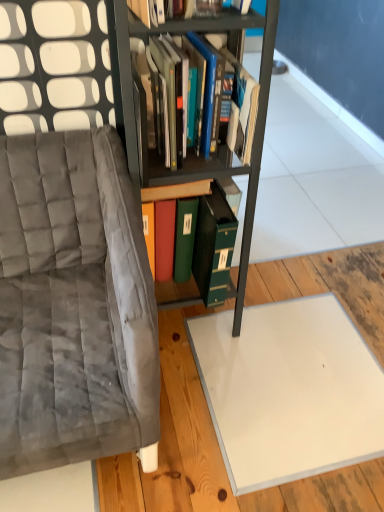
Question: Considering the relative positions of velvet gray chair at left and metallic black bookcase at center in the image provided, is velvet gray chair at left to the left of metallic black bookcase at center from the viewer's perspective?

Choices:
 (A) no
 (B) yes

Answer: (B)

Question: Considering the relative sizes of velvet gray chair at left and metallic black bookcase at center in the image provided, is velvet gray chair at left taller than metallic black bookcase at center?

Choices:
 (A) yes
 (B) no

Answer: (B)

Question: Is velvet gray chair at left not inside metallic black bookcase at center?

Choices:
 (A) yes
 (B) no

Answer: (A)

Question: Is velvet gray chair at left positioned before metallic black bookcase at center?

Choices:
 (A) no
 (B) yes

Answer: (B)

Question: Is velvet gray chair at left turned away from metallic black bookcase at center?

Choices:
 (A) yes
 (B) no

Answer: (B)

Question: Would you say velvet gray chair at left is to the left or to the right of metallic black bookcase at center in the picture?

Choices:
 (A) right
 (B) left

Answer: (B)

Question: From a real-world perspective, is velvet gray chair at left physically located above or below metallic black bookcase at center?

Choices:
 (A) below
 (B) above

Answer: (A)

Question: From the image's perspective, is velvet gray chair at left positioned above or below metallic black bookcase at center?

Choices:
 (A) above
 (B) below

Answer: (B)

Question: Is point click(x=140, y=399) positioned closer to the camera than point click(x=110, y=38)?

Choices:
 (A) closer
 (B) farther

Answer: (A)

Question: Is metallic black bookcase at center inside the boundaries of hardcover books at center, the 1th book in the top-to-bottom sequence, or outside?

Choices:
 (A) inside
 (B) outside

Answer: (B)

Question: From the image's perspective, is metallic black bookcase at center above or below hardcover books at center, the 1th book in the top-to-bottom sequence?

Choices:
 (A) above
 (B) below

Answer: (B)

Question: From a real-world perspective, relative to hardcover books at center, the 1th book in the top-to-bottom sequence, is metallic black bookcase at center vertically above or below?

Choices:
 (A) above
 (B) below

Answer: (B)

Question: In the image, is metallic black bookcase at center positioned in front of or behind hardcover books at center, the 1th book in the top-to-bottom sequence?

Choices:
 (A) front
 (B) behind

Answer: (A)

Question: Considering the positions of green matte file at center, the second book viewed from the top, and metallic black bookcase at center in the image, is green matte file at center, the second book viewed from the top, wider or thinner than metallic black bookcase at center?

Choices:
 (A) thin
 (B) wide

Answer: (B)

Question: Considering the positions of point (175, 196) and point (195, 166), is point (175, 196) closer or farther from the camera than point (195, 166)?

Choices:
 (A) farther
 (B) closer

Answer: (A)